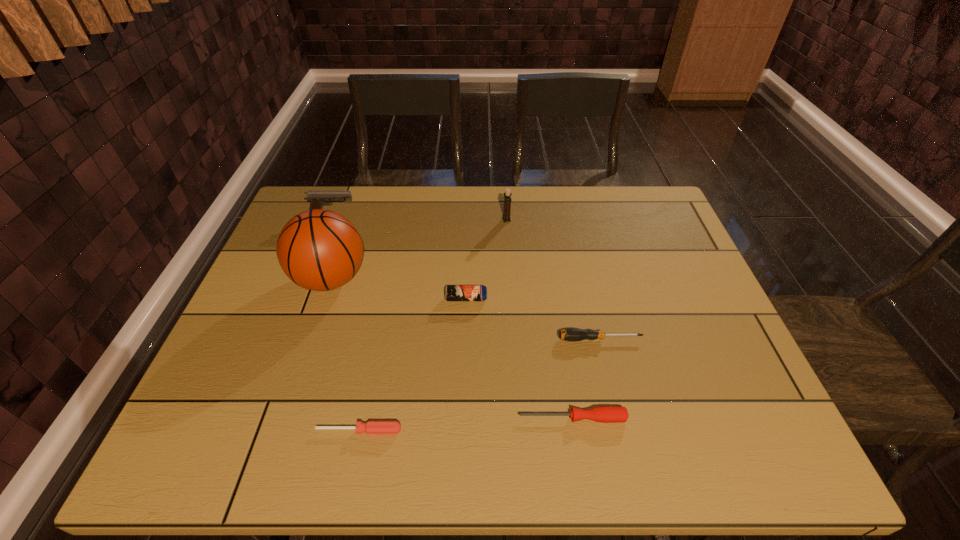
Image resolution: width=960 pixels, height=540 pixels. Identify the location of vacant region between the second farthest screwdriver and the fourth shortest object. (519, 358).

In order to click on vacant space that's between the tallest object and the second farthest screwdriver in this screenshot , I will do `click(451, 349)`.

Where is `free point between the second farthest screwdriver and the leftmost screwdriver`? The image size is (960, 540). free point between the second farthest screwdriver and the leftmost screwdriver is located at coordinates pyautogui.click(x=466, y=424).

Locate an element on the screen. This screenshot has height=540, width=960. free spot between the second nearest object and the fourth tallest object is located at coordinates (519, 358).

In order to click on free space between the fourth shortest object and the sixth farthest object in this screenshot , I will do `click(519, 358)`.

At what (x,y) coordinates should I click in order to perform the action: click on unoccupied position between the fourth object from left to right and the tallest object. Please return your answer as a coordinate pair (x, y). This screenshot has width=960, height=540. Looking at the image, I should click on (398, 289).

I want to click on empty space between the third tallest object and the nearest object, so click(x=346, y=323).

The height and width of the screenshot is (540, 960). Find the location of `empty space between the candle holder and the nearest object`. empty space between the candle holder and the nearest object is located at coordinates (433, 325).

In order to click on empty location between the fourth object from left to right and the second tallest object in this screenshot , I will do `click(487, 259)`.

Point out which object is positioned as the fifth nearest to the second nearest object. Please provide its 2D coordinates. Your answer should be formatted as a tuple, i.e. [(x, y)], where the tuple contains the x and y coordinates of a point satisfying the conditions above.

[(507, 195)]